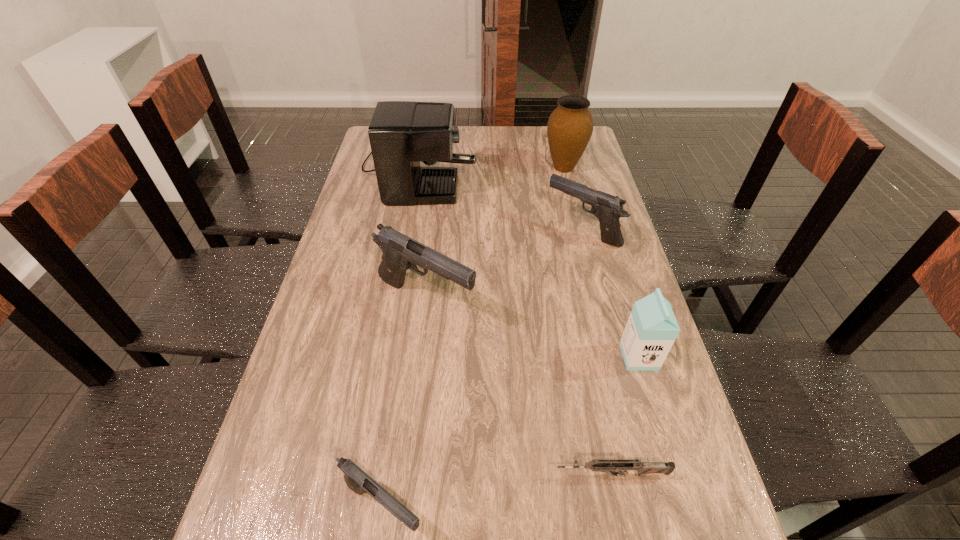
Find the location of a particular element. The width and height of the screenshot is (960, 540). coffee maker located at the far edge is located at coordinates point(402,133).

Where is `urn at the far edge`? urn at the far edge is located at coordinates (569, 129).

Locate an element on the screen. This screenshot has height=540, width=960. coffee maker that is at the left edge is located at coordinates (402, 133).

Locate an element on the screen. gun located at the left edge is located at coordinates coord(400,252).

The image size is (960, 540). What are the coordinates of `urn that is at the right edge` in the screenshot? It's located at (569, 129).

Locate an element on the screen. The height and width of the screenshot is (540, 960). milk carton at the right edge is located at coordinates (651, 330).

The height and width of the screenshot is (540, 960). Identify the location of object present at the far left corner. pos(402,133).

The image size is (960, 540). I want to click on object present at the far right corner, so click(569, 129).

In the image, there is a desktop. At what (x,y) coordinates should I click in order to perform the action: click on vacant space at the far edge. Please return your answer as a coordinate pair (x, y). Image resolution: width=960 pixels, height=540 pixels. Looking at the image, I should click on (547, 147).

Find the location of a particular element. vacant space at the left edge of the desktop is located at coordinates (331, 252).